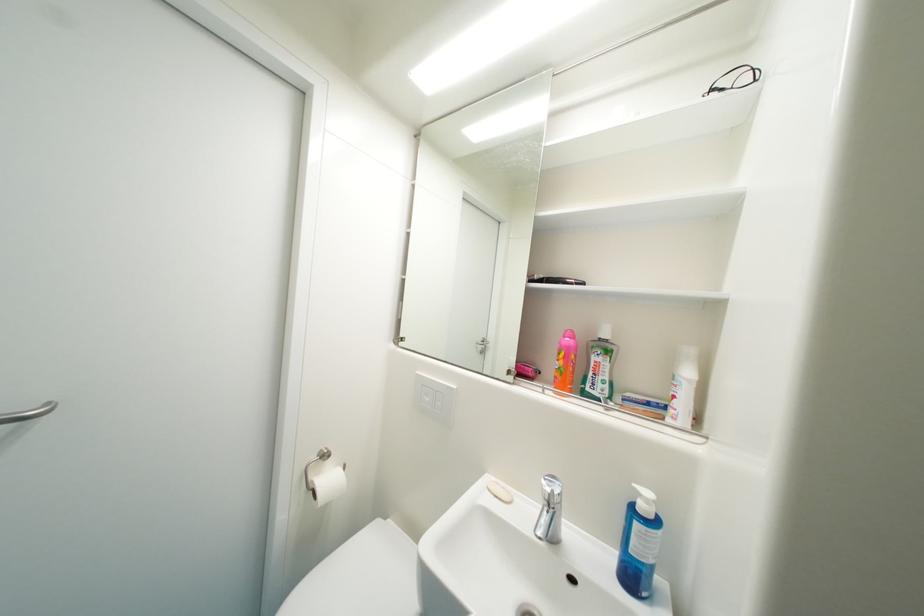
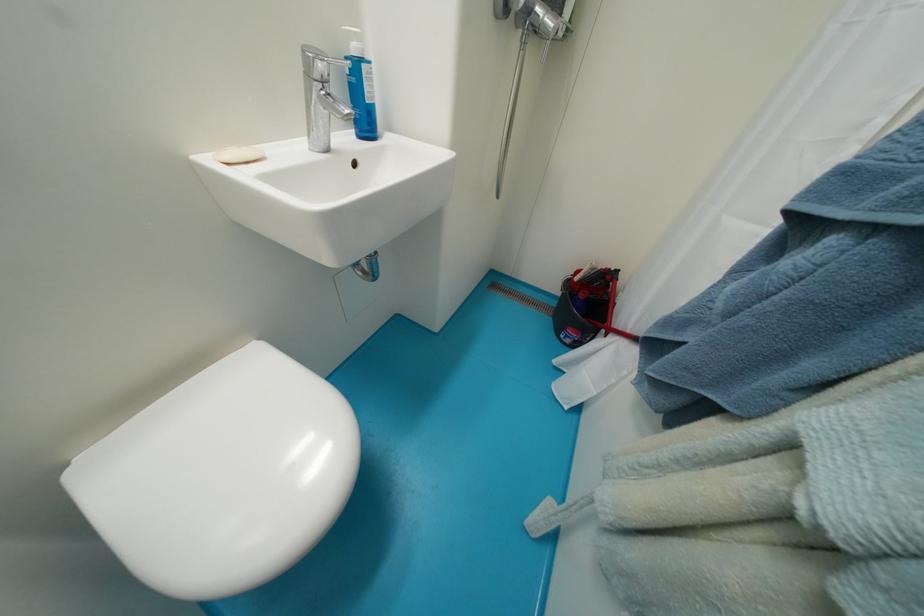
Locate, in the second image, the point that corresponds to point (642, 527) in the first image.

(371, 70)